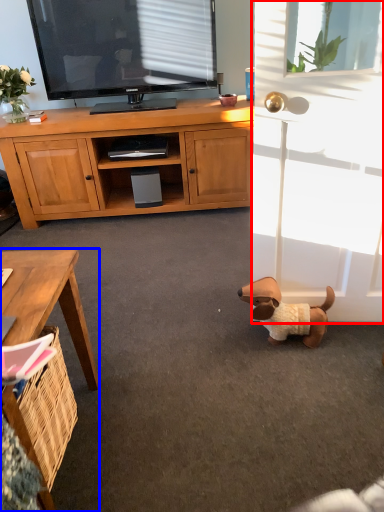
Question: Which object appears farthest to the camera in this image, screen door (highlighted by a red box) or desk (highlighted by a blue box)?

Choices:
 (A) screen door
 (B) desk

Answer: (A)